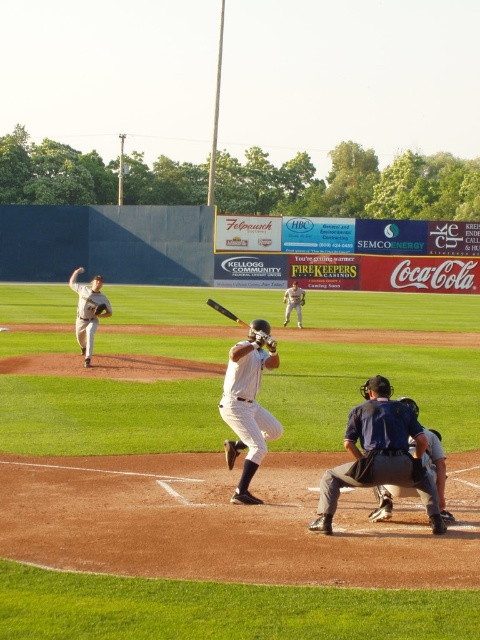
Question: Is dark blue padded vest at lower center below white uniform baseball player at center?

Choices:
 (A) yes
 (B) no

Answer: (A)

Question: Which of the following is the farthest from the observer?

Choices:
 (A) (239, 392)
 (B) (236, 317)
 (C) (375, 513)

Answer: (B)

Question: Which point is closer to the camera taking this photo?

Choices:
 (A) (213, 307)
 (B) (300, 305)
 (C) (252, 342)

Answer: (C)

Question: Which object is farther from the camera taking this photo?

Choices:
 (A) black matte baseball bat at center
 (B) brown leather glove at center
 (C) gray uniformed pitcher at left

Answer: (B)

Question: Is dark blue padded vest at lower center below white matte baseball bat at center?

Choices:
 (A) yes
 (B) no

Answer: (A)

Question: From the image, what is the correct spatial relationship of white matte baseball bat at center in relation to white uniform baseball player at center?

Choices:
 (A) left
 (B) right

Answer: (A)